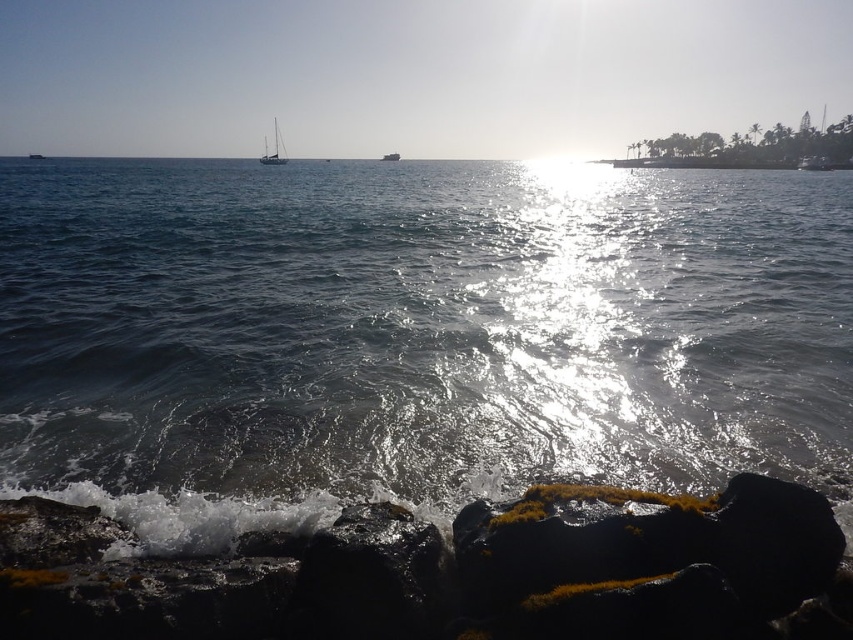
Is glistening water at center bigger than smooth black rock at lower left?

Yes.

What do you see at coordinates (413, 333) in the screenshot?
I see `glistening water at center` at bounding box center [413, 333].

Describe the element at coordinates (413, 333) in the screenshot. The height and width of the screenshot is (640, 853). I see `glistening water at center` at that location.

This screenshot has height=640, width=853. I want to click on glistening water at center, so click(413, 333).

Is point (434, 564) more distant than point (283, 147)?

No.

Does smooth black rock at lower left have a lesser height compared to white glossy sailboat at upper center?

Indeed, smooth black rock at lower left has a lesser height compared to white glossy sailboat at upper center.

Based on the photo, who is more forward, (515, 627) or (265, 140)?

Point (515, 627) is more forward.

At what (x,y) coordinates should I click in order to perform the action: click on smooth black rock at lower left. Please return your answer as a coordinate pair (x, y). Looking at the image, I should click on (450, 572).

Who is positioned more to the left, white glossy sailboat at upper center or metallic silver boat at center?

From the viewer's perspective, white glossy sailboat at upper center appears more on the left side.

Can you confirm if white glossy sailboat at upper center is bigger than metallic silver boat at center?

Correct, white glossy sailboat at upper center is larger in size than metallic silver boat at center.

Where is `white glossy sailboat at upper center`? The image size is (853, 640). white glossy sailboat at upper center is located at coordinates (274, 148).